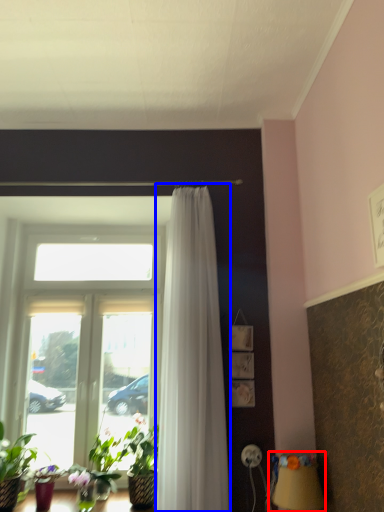
Question: Among these objects, which one is nearest to the camera, table lamp (highlighted by a red box) or curtain (highlighted by a blue box)?

Choices:
 (A) table lamp
 (B) curtain

Answer: (A)